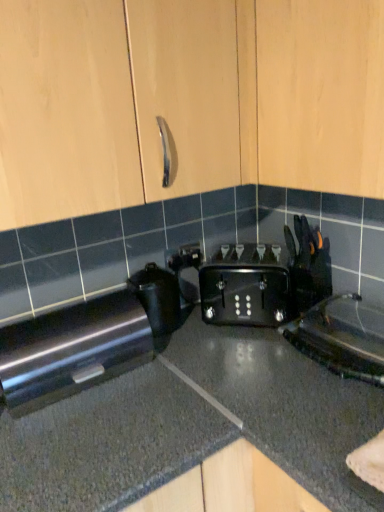
Where is `free spot above black granite countertop at center (from a real-world perspective)`? The width and height of the screenshot is (384, 512). free spot above black granite countertop at center (from a real-world perspective) is located at coordinates [268, 371].